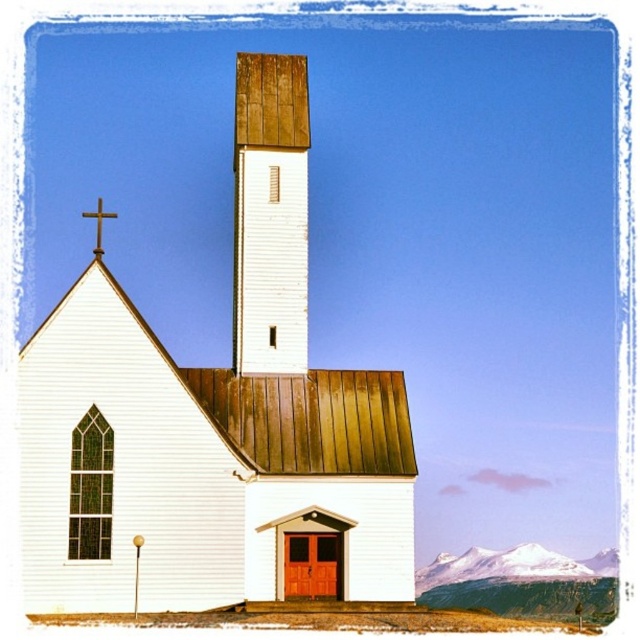
Based on the photo, you are standing in front of the church and see two points marked on the steeple. The first point is at coordinates point [115,429] and the second is at point [97,225]. Which point is closer to your current position?

Point [115,429] is closer to the camera than point [97,225], so the first point is closer to your current position.

You are a photographer planning to capture the white wooden church at center and the gold metallic cross at upper left in a single frame. Considering their sizes, which object will appear bigger in the photo?

The white wooden church at center will appear bigger in the photo because it is larger in size than the gold metallic cross at upper left.